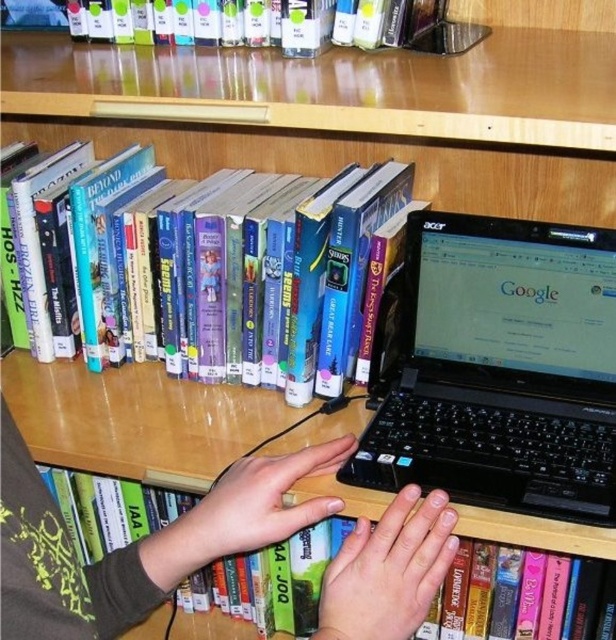
You are a librarian organizing books on a shelf. You notice the hardcover book at center and the green matte hands at center. Which object is closer to you?

The hardcover book at center is closer to you because the green matte hands at center are behind it.

Based on the photo, you are organizing a study space and need to ensure that the black plastic laptop at center can fit under the desk without overlapping the green matte hands at center. Based on their sizes, will the laptop fit comfortably?

The black plastic laptop at center is smaller than the green matte hands at center, so it should fit comfortably under the desk without overlapping.